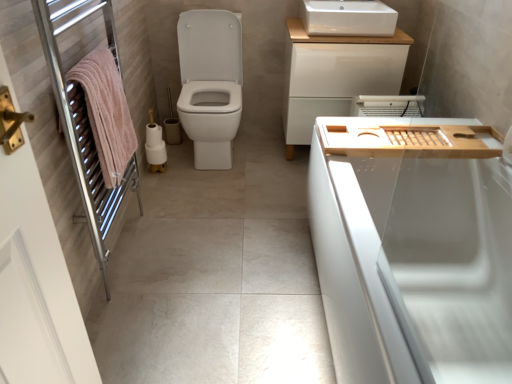
Locate an element on the screen. The width and height of the screenshot is (512, 384). vacant space behind pink towel at left is located at coordinates (170, 201).